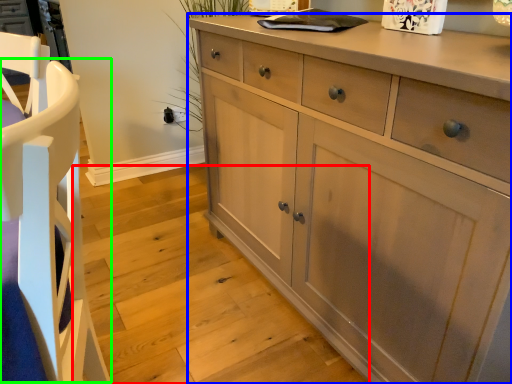
Question: Which is nearer to the stair (highlighted by a red box)? chest of drawers (highlighted by a blue box) or armchair (highlighted by a green box).

Choices:
 (A) chest of drawers
 (B) armchair

Answer: (A)